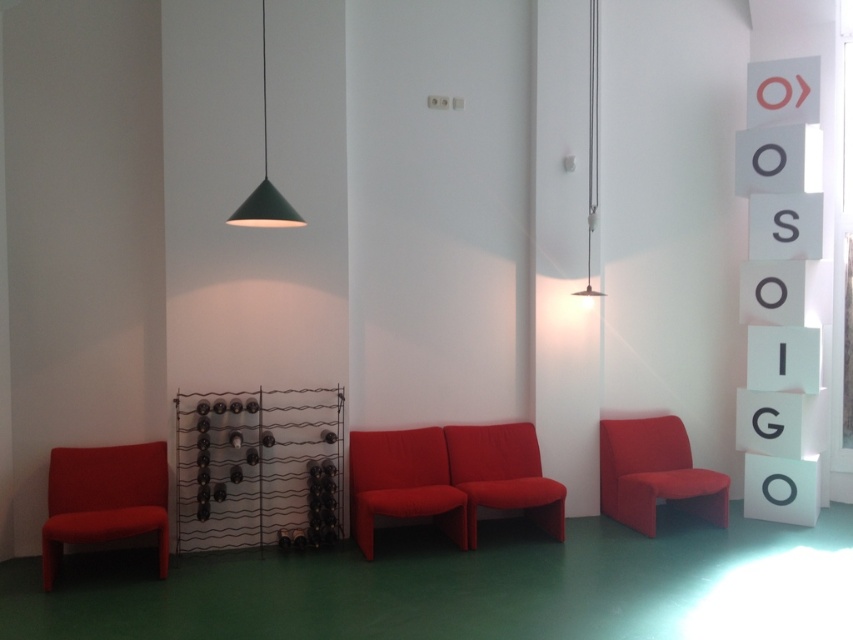
From the picture: You are a guest in this room and want to sit on the matte red armchair at left. To reach it, you must walk under the metallic pendant light at upper center. Will you have to move to the left or the right to avoid bumping your head?

The matte red armchair at left is positioned on the left side of the metallic pendant light at upper center. To avoid bumping your head, you should move to the left to reach the matte red armchair at left while staying clear of the pendant light.

You are standing in the middle of the room and want to move to the window located to your right. To avoid walking through the space between the matte red armchair at left and the matte red sofa at center, which direction should you go?

You should go to the right side of the room because the matte red armchair at left is in front of the matte red sofa at center, meaning there is no clear path between them to walk through.